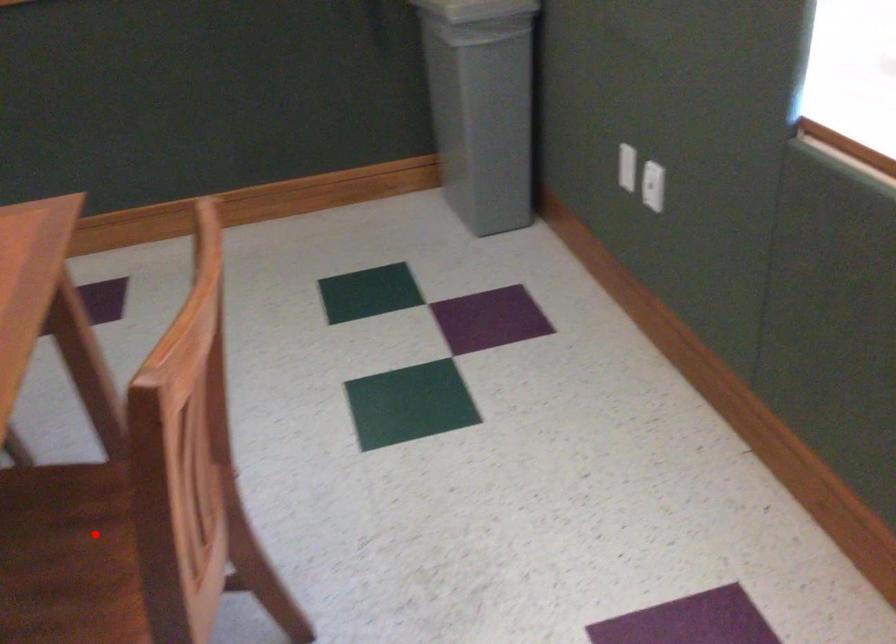
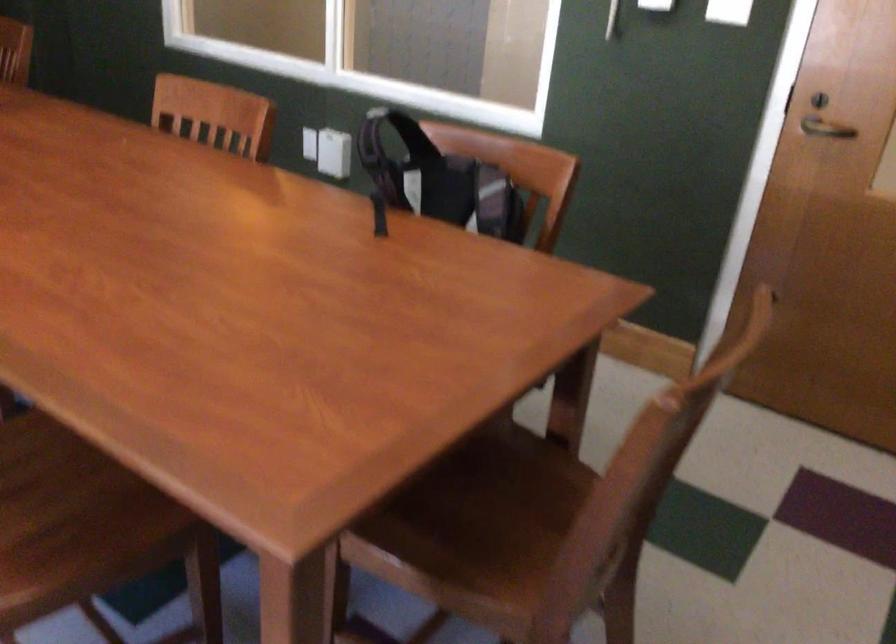
Locate, in the second image, the point that corresponds to the highlighted location in the first image.

(52, 498)